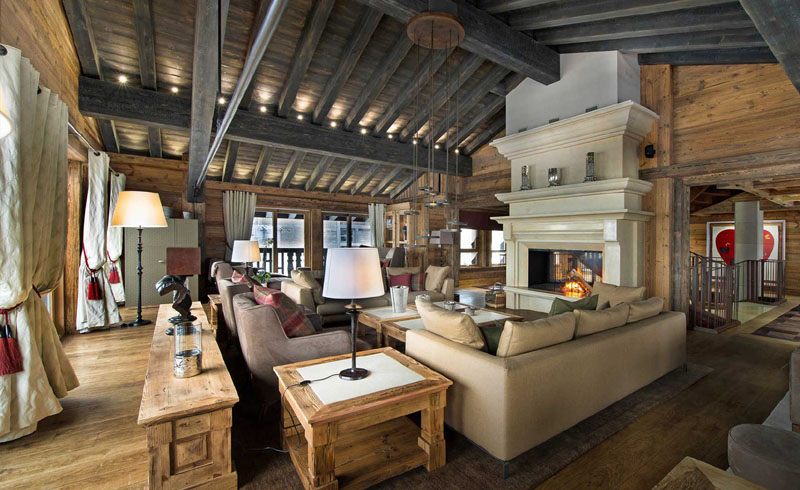
In order to click on lamp in this screenshot , I will do `click(378, 269)`.